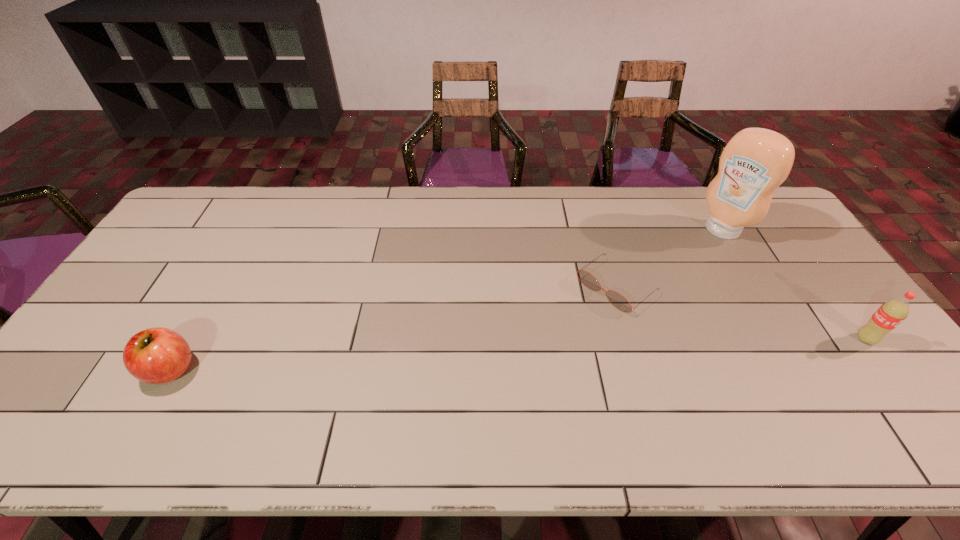
This screenshot has height=540, width=960. Find the location of `object that is at the far right corner`. object that is at the far right corner is located at coordinates (756, 161).

The width and height of the screenshot is (960, 540). Find the location of `vacant space at the far edge`. vacant space at the far edge is located at coordinates (321, 207).

Where is `blank space at the near edge`? blank space at the near edge is located at coordinates (823, 393).

Locate an element on the screen. vacant space at the left edge of the desktop is located at coordinates (110, 322).

The height and width of the screenshot is (540, 960). In the image, there is a desktop. In order to click on vacant space at the near right corner in this screenshot , I will do `click(904, 393)`.

Identify the location of free spot between the second tallest object and the farthest object. This screenshot has width=960, height=540. pyautogui.click(x=794, y=285).

The image size is (960, 540). In order to click on free space that is in between the second tallest object and the apple in this screenshot , I will do `click(518, 354)`.

The height and width of the screenshot is (540, 960). Identify the location of vacant area that lies between the sunglasses and the rightmost object. (741, 313).

You are a GUI agent. You are given a task and a screenshot of the screen. Output one action in this format:
    pyautogui.click(x=<x>, y=<y>)
    Task: Click on the empty location between the tallest object and the soda
    Image resolution: width=960 pixels, height=540 pixels.
    Given the screenshot: What is the action you would take?
    pyautogui.click(x=794, y=285)

Image resolution: width=960 pixels, height=540 pixels. In order to click on vacant space that is in between the sunglasses and the rightmost object in this screenshot , I will do `click(741, 313)`.